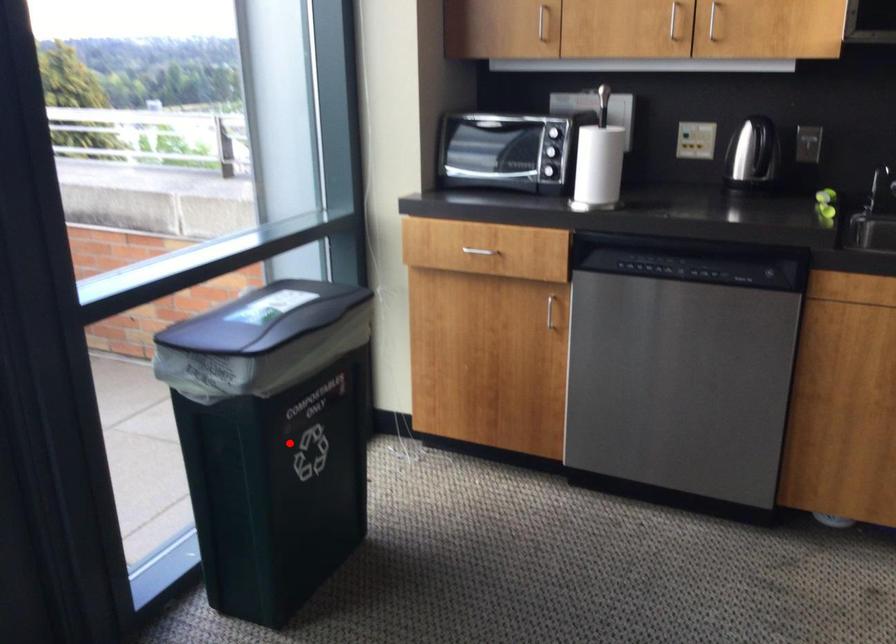
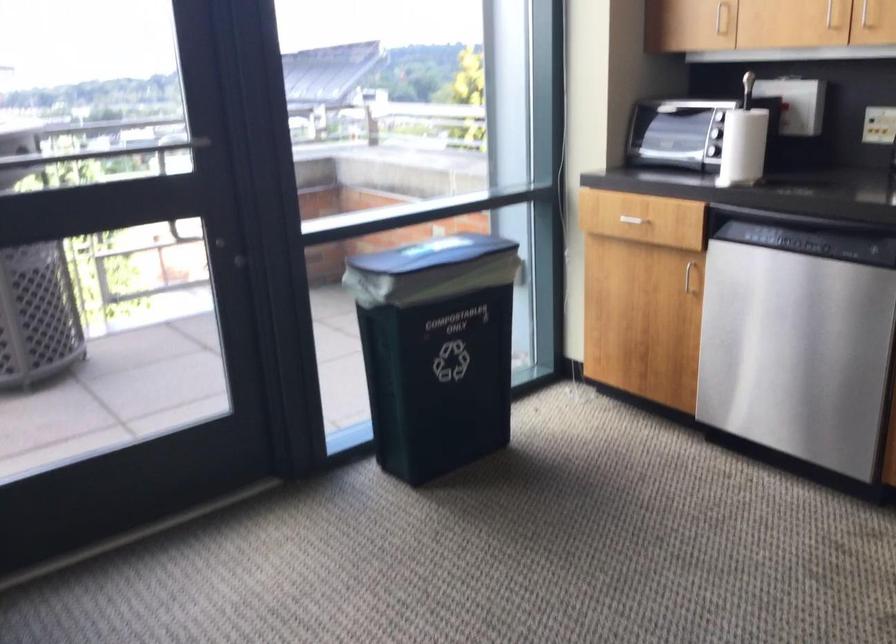
The point at the highlighted location is marked in the first image. Where is the corresponding point in the second image?

(435, 350)